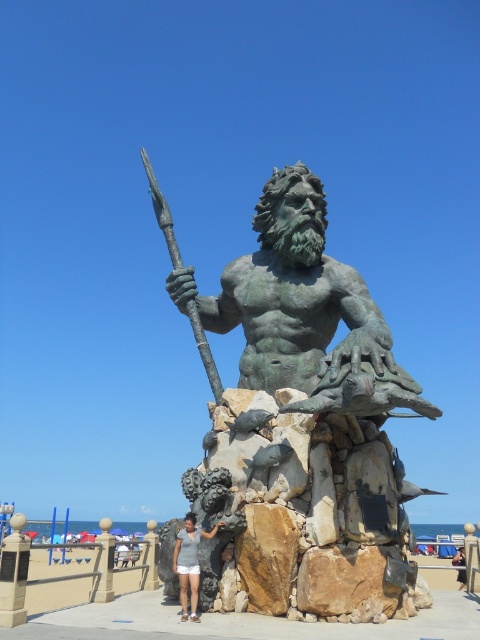
You are standing at the origin point in the image. The green patina statue at center is located at coordinates 0.647 on the x axis and 0.627 on the y axis. If you want to reach the statue, in which direction should you move? Please answer with either north, south, east, or west.

The green patina statue at center is located at coordinates 0.647 on the x axis and 0.627 on the y axis. Since the origin is at the bottom left corner of the image, moving towards higher x values means east, and higher y values mean north. Therefore, to reach the statue, you should move northeast.

You are standing at the beach and see two points in the image. The first point is at coordinate point (273, 234), and the second point is at coordinate point (456, 564). Which point is closer to you?

Point (273, 234) is in front of point (456, 564), so the first point is closer to you.

You are a photographer standing at the beach and want to capture both the green patina statue at center and the white cotton shorts at center in the same frame. Which object should you place on the left side of your camera frame to ensure both are included?

To include both the green patina statue at center and the white cotton shorts at center in the same frame, you should place the white cotton shorts at center on the left side of your camera frame. Since the green patina statue at center is on the right side of the white cotton shorts at center, positioning the shorts on the left will allow the statue to naturally fall on the right side of the frame, ensuring both are captured.